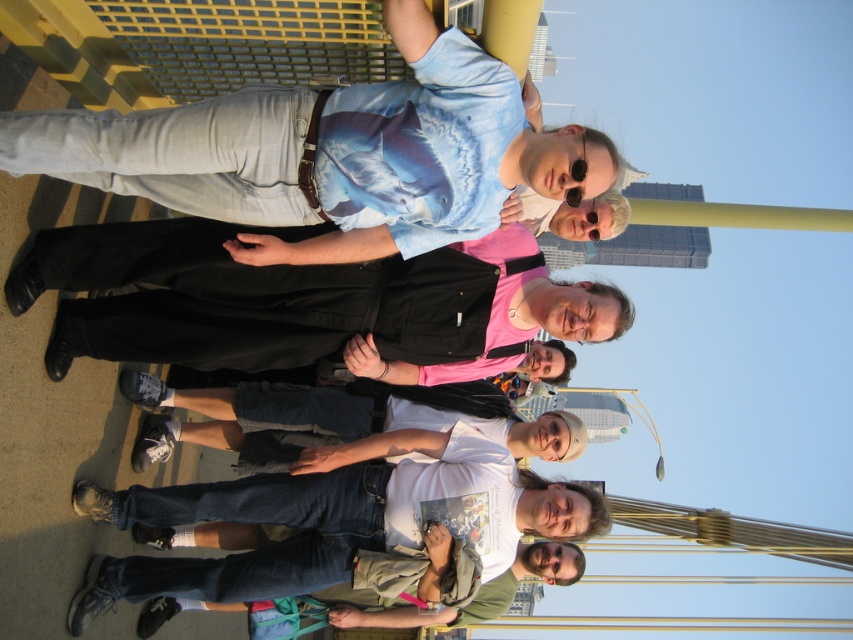
Question: Which point is closer to the camera taking this photo?

Choices:
 (A) (155, 144)
 (B) (444, 282)

Answer: (A)

Question: Does shark print t-shirt at upper center appear on the left side of black cotton pants at center?

Choices:
 (A) yes
 (B) no

Answer: (B)

Question: Can you confirm if shark print t-shirt at upper center is positioned above black cotton pants at center?

Choices:
 (A) yes
 (B) no

Answer: (A)

Question: Which point is closer to the camera?

Choices:
 (A) shark print t-shirt at upper center
 (B) black cotton pants at center

Answer: (A)

Question: Where is shark print t-shirt at upper center located in relation to black cotton pants at center in the image?

Choices:
 (A) left
 (B) right

Answer: (B)